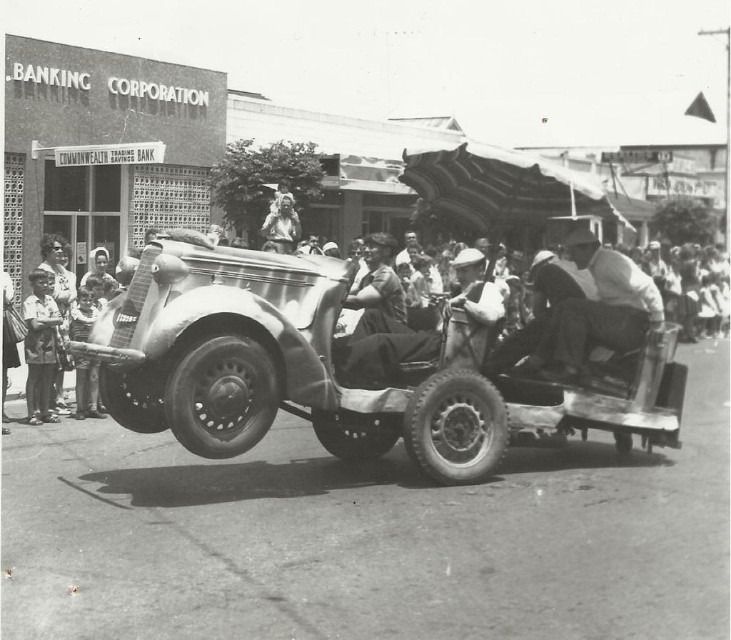
Between point (637, 282) and point (42, 392), which one is positioned in front?

Positioned in front is point (637, 282).

Between plaid fabric shirt at center and light brown fabric child at lower left, which one has more height?

Standing taller between the two is light brown fabric child at lower left.

Is point (552, 346) farther from camera compared to point (48, 307)?

No, it is not.

This screenshot has width=731, height=640. What are the coordinates of `plaid fabric shirt at center` in the screenshot? It's located at (598, 310).

Between point (374, 356) and point (363, 304), which one is positioned behind?

Point (363, 304)

Can you confirm if smooth leather jacket at center is smaller than matte black dress at center?

Incorrect, smooth leather jacket at center is not smaller in size than matte black dress at center.

Who is more distant from viewer, (493, 305) or (374, 330)?

The point (374, 330) is more distant.

Locate an element on the screen. smooth leather jacket at center is located at coordinates (382, 330).

Who is positioned more to the left, polished chrome car at center or light brown fabric child at lower left?

Positioned to the left is light brown fabric child at lower left.

Which is in front, point (137, 396) or point (29, 410)?

Point (137, 396)

Describe the element at coordinates (338, 365) in the screenshot. I see `polished chrome car at center` at that location.

At what (x,y) coordinates should I click in order to perform the action: click on polished chrome car at center. Please return your answer as a coordinate pair (x, y). This screenshot has height=640, width=731. Looking at the image, I should click on (338, 365).